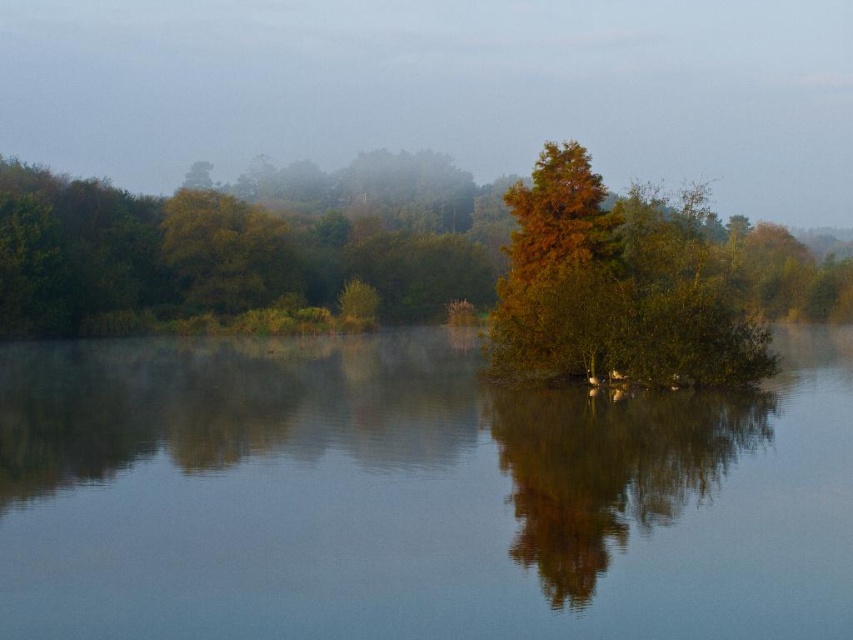
You are standing at the point marked as point (415, 497) in the image. Looking around, you notice transparent water at center. What is directly beneath your feet?

The point (415, 497) is located at transparent water at center, so the transparent water at center is directly beneath your feet.